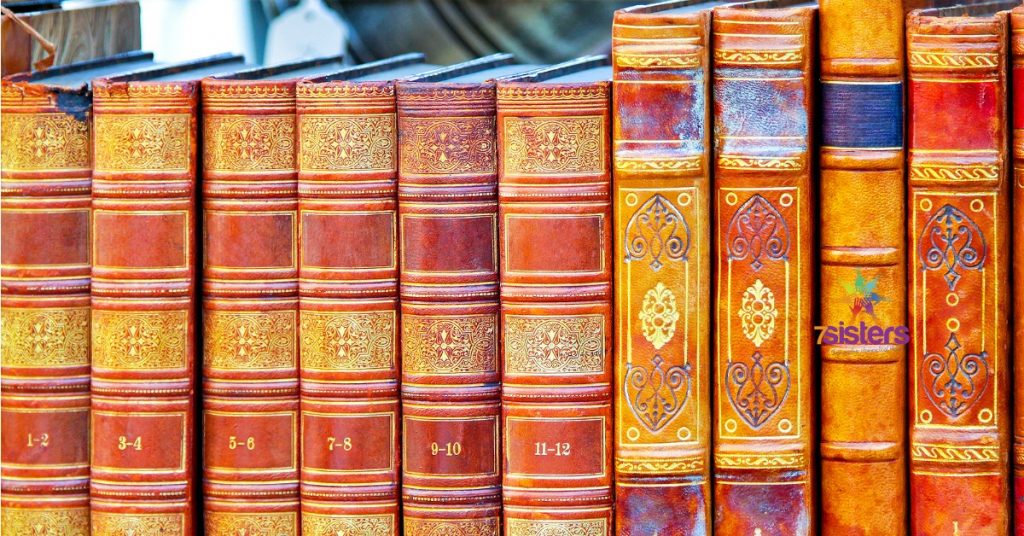
This screenshot has height=536, width=1024. What are the coordinates of `books with yellow` in the screenshot? It's located at (32, 136), (138, 140), (255, 137), (355, 138), (467, 135), (552, 134), (680, 269), (745, 267), (845, 232), (962, 173).